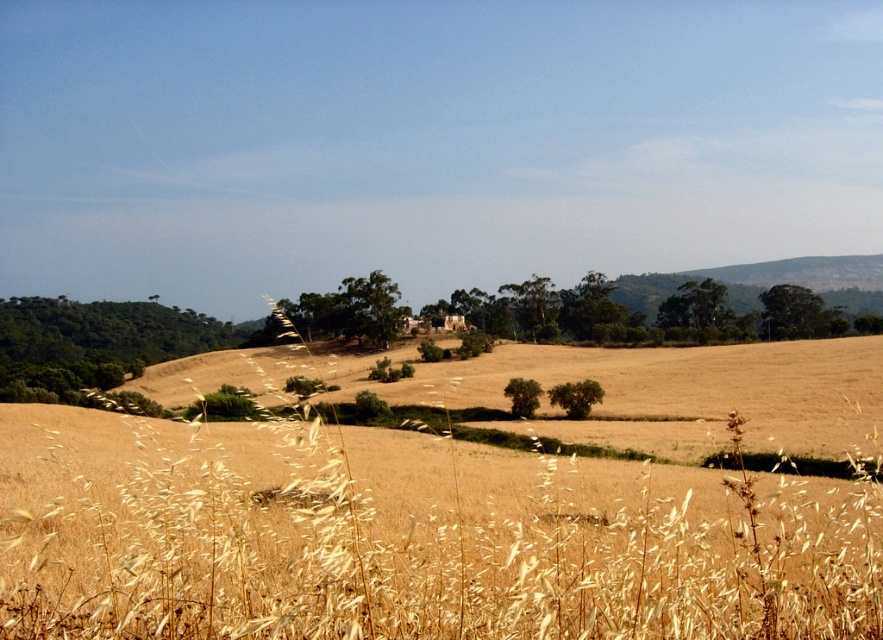
Does golden dry grass at center have a greater height compared to green leafy tree at left?

In fact, golden dry grass at center may be shorter than green leafy tree at left.

This screenshot has height=640, width=883. What do you see at coordinates (451, 506) in the screenshot? I see `golden dry grass at center` at bounding box center [451, 506].

What do you see at coordinates (451, 506) in the screenshot?
I see `golden dry grass at center` at bounding box center [451, 506].

Image resolution: width=883 pixels, height=640 pixels. I want to click on golden dry grass at center, so click(x=451, y=506).